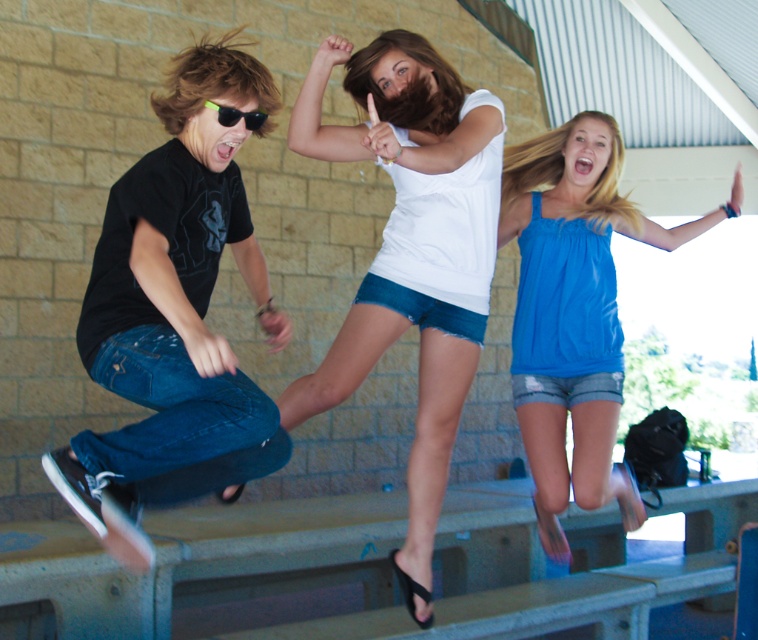
Question: Where is black matte t-shirt at left located in relation to blue satin tank top at upper right in the image?

Choices:
 (A) below
 (B) above

Answer: (B)

Question: Considering the real-world distances, which object is farthest from the white matte tank top at center?

Choices:
 (A) blue satin tank top at upper right
 (B) black matte t-shirt at left

Answer: (A)

Question: Observing the image, what is the correct spatial positioning of white matte tank top at center in reference to black plastic sunglasses at left?

Choices:
 (A) above
 (B) below

Answer: (B)

Question: Which point appears closest to the camera in this image?

Choices:
 (A) (221, 108)
 (B) (202, 488)
 (C) (376, 337)
 (D) (531, 328)

Answer: (A)

Question: Is white matte tank top at center to the left of blue satin tank top at upper right from the viewer's perspective?

Choices:
 (A) no
 (B) yes

Answer: (B)

Question: Considering the real-world distances, which object is farthest from the blue satin tank top at upper right?

Choices:
 (A) white matte tank top at center
 (B) black matte t-shirt at left

Answer: (B)